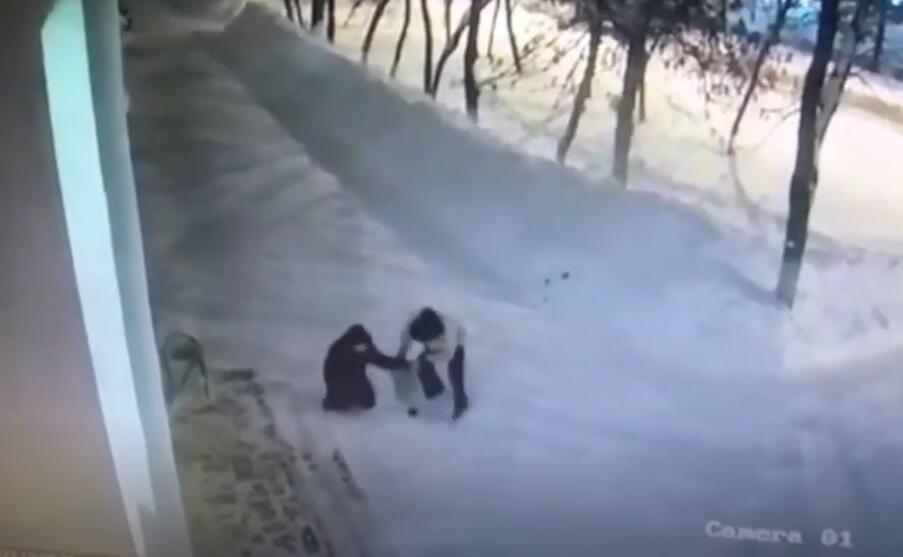
The width and height of the screenshot is (903, 557). Identify the location of vertical wall section. (79, 232).